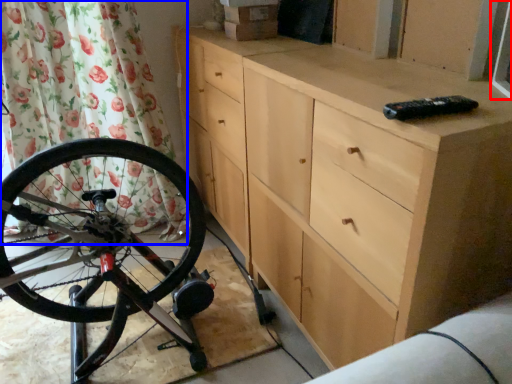
Question: Among these objects, which one is farthest to the camera, window screen (highlighted by a red box) or shower curtain (highlighted by a blue box)?

Choices:
 (A) window screen
 (B) shower curtain

Answer: (B)